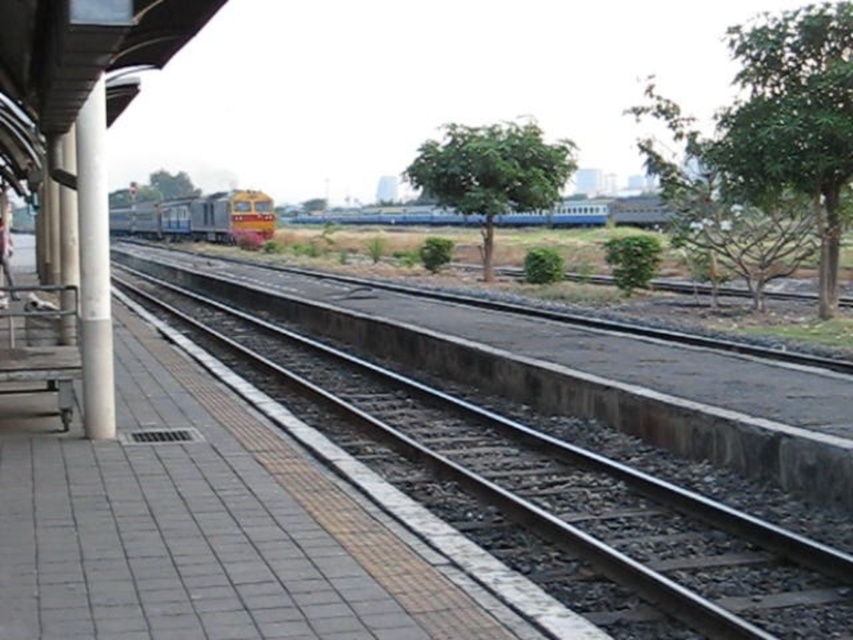
Question: Does gray concrete platform at center appear on the left side of yellow metallic train at center?

Choices:
 (A) no
 (B) yes

Answer: (A)

Question: Which point appears closest to the camera in this image?

Choices:
 (A) (206, 208)
 (B) (387, 628)
 (C) (4, 236)

Answer: (B)

Question: Can you confirm if gray concrete platform at center is positioned above white fabric pants at left?

Choices:
 (A) yes
 (B) no

Answer: (B)

Question: Which object appears closest to the camera in this image?

Choices:
 (A) white concrete pillar at left
 (B) gray concrete platform at center

Answer: (A)

Question: Which of the following is the farthest from the observer?

Choices:
 (A) (256, 227)
 (B) (79, 253)
 (C) (9, 280)

Answer: (A)

Question: Can you confirm if white concrete pillar at left is bigger than white fabric pants at left?

Choices:
 (A) no
 (B) yes

Answer: (B)